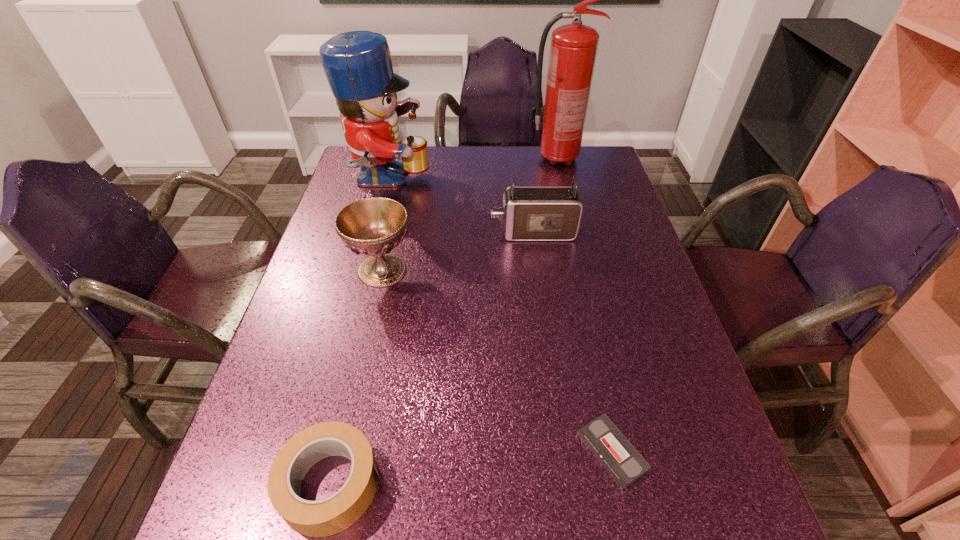
What are the coordinates of `vacant region between the third nearest object and the fire extinguisher` in the screenshot? It's located at (469, 214).

Locate an element on the screen. The width and height of the screenshot is (960, 540). vacant region between the videotape and the fifth shortest object is located at coordinates (500, 316).

You are a GUI agent. You are given a task and a screenshot of the screen. Output one action in this format:
    pyautogui.click(x=<x>, y=<y>)
    Task: Click on the vacant area between the chalice and the third farthest object
    The height and width of the screenshot is (540, 960).
    Given the screenshot: What is the action you would take?
    pyautogui.click(x=458, y=252)

Image resolution: width=960 pixels, height=540 pixels. I want to click on free space between the second shortest object and the videotape, so click(472, 468).

Identify the location of blank region between the camcorder and the fifth shortest object. This screenshot has height=540, width=960. (461, 207).

In order to click on empty location between the videotape and the second shortest object in this screenshot , I will do coord(472,468).

Locate an element on the screen. object that ranks as the second closest to the camcorder is located at coordinates (358, 66).

The image size is (960, 540). Identify the location of the fourth closest object relative to the fifth tallest object. (358, 66).

Image resolution: width=960 pixels, height=540 pixels. What are the coordinates of `free space that satisfies the following two spatial constraints: 1. on the back side of the shortest object; 2. at the lens of the camcorder` in the screenshot? It's located at (565, 233).

Find the location of a particular element. free spot that satisfies the following two spatial constraints: 1. on the front-facing side of the second tallest object; 2. on the back side of the shortest object is located at coordinates (317, 451).